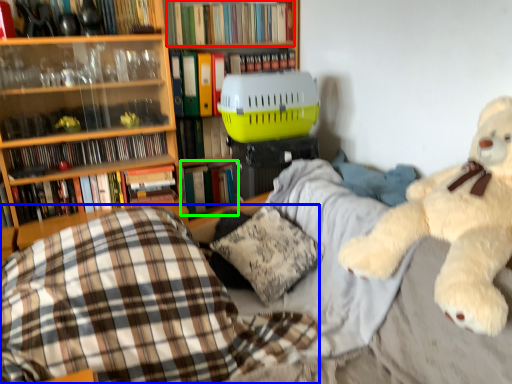
Question: Considering the real-world distances, which object is closest to book (highlighted by a red box)? plaid (highlighted by a blue box) or book (highlighted by a green box).

Choices:
 (A) plaid
 (B) book

Answer: (B)